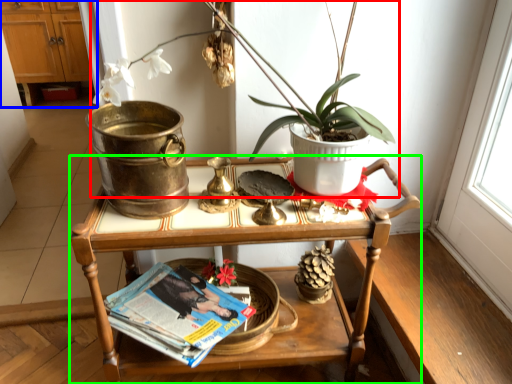
Question: Considering the real-world distances, which object is farthest from houseplant (highlighted by a red box)? dresser (highlighted by a blue box) or table (highlighted by a green box)?

Choices:
 (A) dresser
 (B) table

Answer: (A)